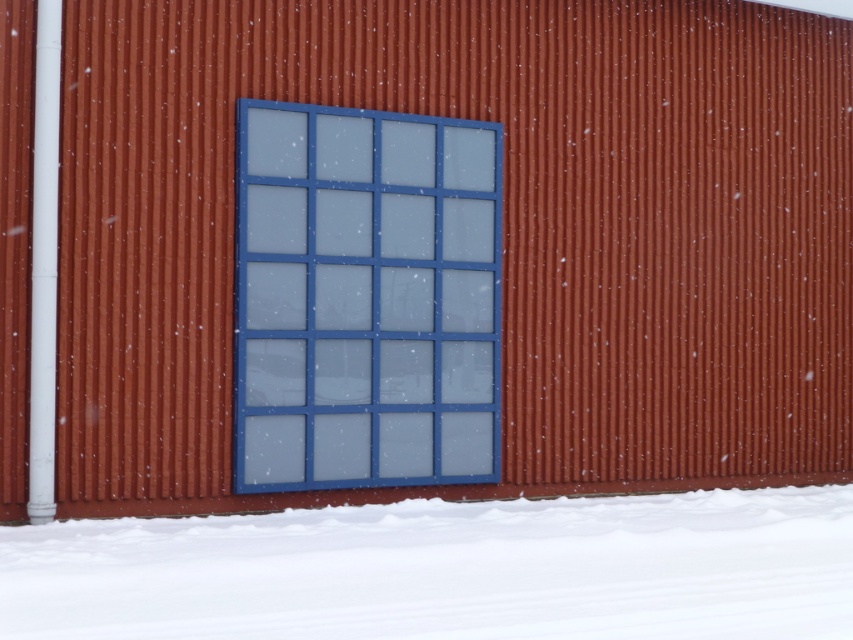
Is white powdery snow at lower center thinner than blue glass window at center?

Incorrect, white powdery snow at lower center's width is not less than blue glass window at center's.

Who is higher up, white powdery snow at lower center or blue glass window at center?

blue glass window at center is higher up.

Is point (209, 520) in front of point (426, 449)?

Yes, it is.

You are a GUI agent. You are given a task and a screenshot of the screen. Output one action in this format:
    pyautogui.click(x=<x>, y=<y>)
    Task: Click on the white powdery snow at lower center
    
    Given the screenshot: What is the action you would take?
    pyautogui.click(x=447, y=570)